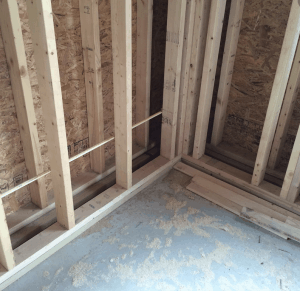
Locate an element on the screen. The height and width of the screenshot is (291, 300). baseboard is located at coordinates (79, 190).